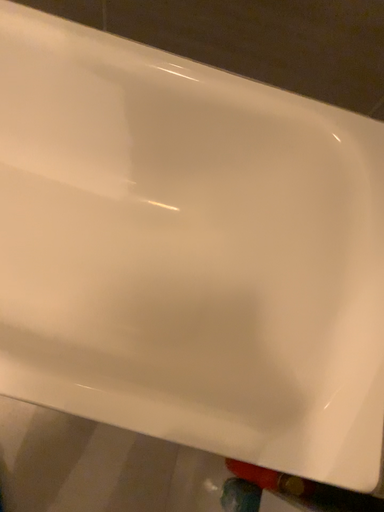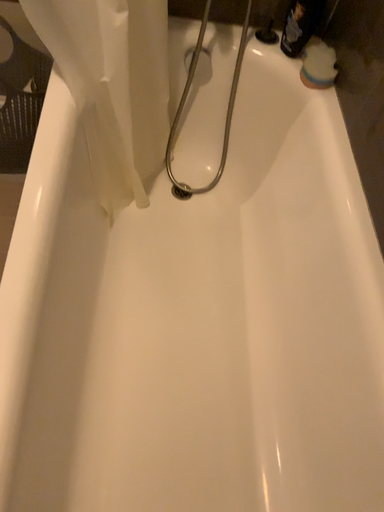
Question: Which way did the camera rotate in the video?

Choices:
 (A) rotated left
 (B) rotated right

Answer: (A)